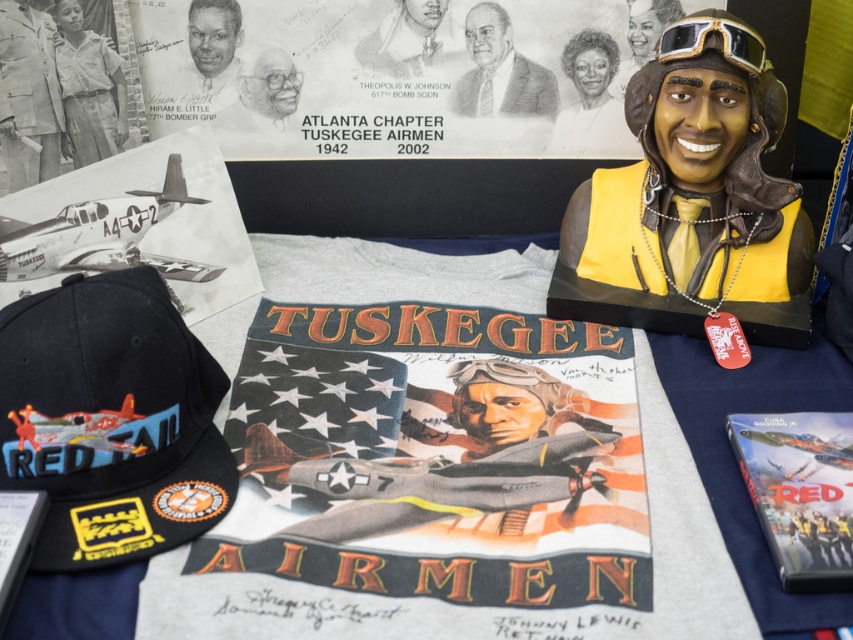
Between black fabric baseball cap at lower left and smooth skin portrait at upper center, which one has less height?

smooth skin portrait at upper center

Can you confirm if black fabric baseball cap at lower left is wider than smooth skin portrait at upper center?

Yes.

Consider the image. Who is more distant from viewer, (91,289) or (589,92)?

Point (589,92)

You are a GUI agent. You are given a task and a screenshot of the screen. Output one action in this format:
    pyautogui.click(x=<x>, y=<y>)
    Task: Click on the black fabric baseball cap at lower left
    
    Given the screenshot: What is the action you would take?
    pyautogui.click(x=109, y=419)

From the picture: Between matte yellow wax bust at right and light brown leather jacket at upper left, which one is positioned lower?

Positioned lower is matte yellow wax bust at right.

Does matte yellow wax bust at right appear over light brown leather jacket at upper left?

Incorrect, matte yellow wax bust at right is not positioned above light brown leather jacket at upper left.

The height and width of the screenshot is (640, 853). Identify the location of matte yellow wax bust at right. (689, 186).

Is smooth black portrait at upper center shorter than gray pencil sketch of man at upper center?

Yes, smooth black portrait at upper center is shorter than gray pencil sketch of man at upper center.

Is point (405, 74) in front of point (236, 116)?

Yes, it is.

At what (x,y) coordinates should I click in order to perform the action: click on smooth black portrait at upper center. Please return your answer as a coordinate pair (x, y). Looking at the image, I should click on 410,42.